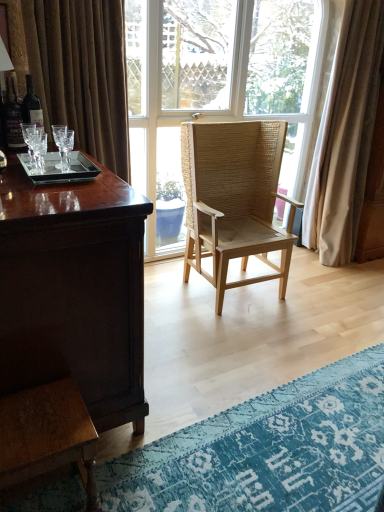
I want to click on vacant space situated above shiny brown wood desk at left (from a real-world perspective), so click(44, 185).